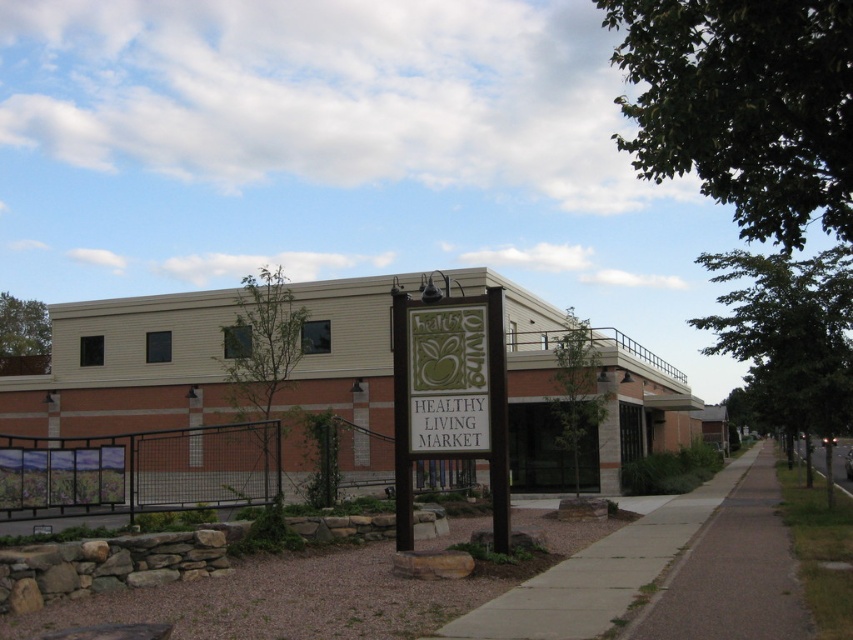
Question: Which object appears closest to the camera in this image?

Choices:
 (A) gray asphalt sidewalk at lower right
 (B) brown wooden sign at center
 (C) concrete sidewalk at center

Answer: (A)

Question: Estimate the real-world distances between objects in this image. Which object is closer to the concrete sidewalk at center?

Choices:
 (A) brown wooden sign at center
 (B) gray asphalt sidewalk at lower right

Answer: (B)

Question: Can you confirm if gray asphalt sidewalk at lower right is positioned below concrete sidewalk at center?

Choices:
 (A) no
 (B) yes

Answer: (B)

Question: In this image, where is brown wooden sign at center located relative to gray asphalt sidewalk at lower right?

Choices:
 (A) below
 (B) above

Answer: (B)

Question: Which of these objects is positioned closest to the gray asphalt sidewalk at lower right?

Choices:
 (A) green fabric sign at center
 (B) brown wooden sign at center
 (C) concrete sidewalk at center

Answer: (C)

Question: Can you confirm if brown wooden sign at center is bigger than gray asphalt sidewalk at lower right?

Choices:
 (A) yes
 (B) no

Answer: (B)